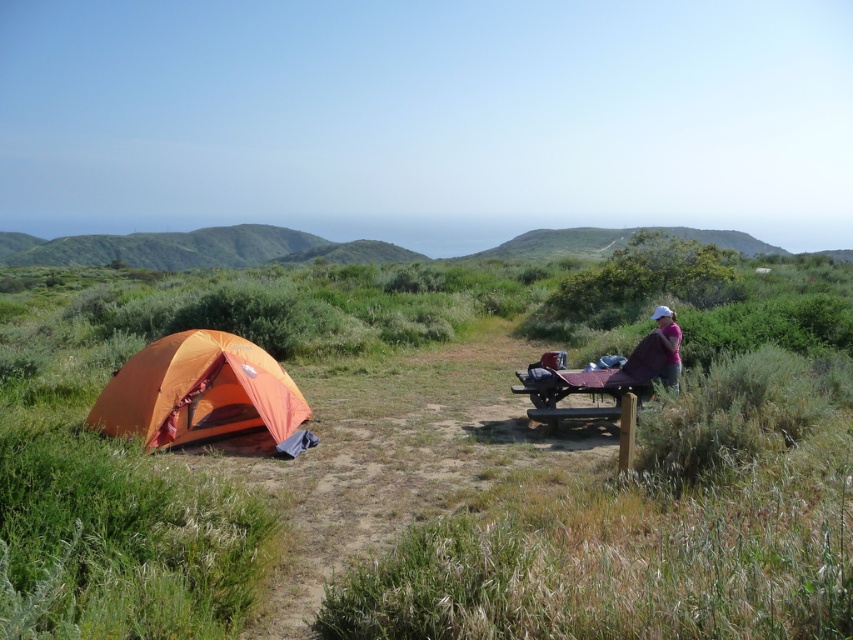
You are planning to set up a new tent in the camping area shown. The orange fabric tent at left is already there. Based on its position at coordinates 0.613 on the x and 0.233 on the y, can you determine if it is placed closer to the right edge of the frame or the left edge?

The orange fabric tent at left is located at point 0.613 on the x and 0.233 on the y. Since the x coordinate is 0.613, which is closer to 1.0, it means the tent is positioned closer to the right edge of the frame rather than the left edge.

You are a hiker trying to decide where to place your new gear bag. You have two options near the orange fabric tent at left and the pink fabric at right. Which location has more space for your gear bag?

The orange fabric tent at left is bigger than the pink fabric at right, so there is more space for your gear bag at the orange fabric tent at left.